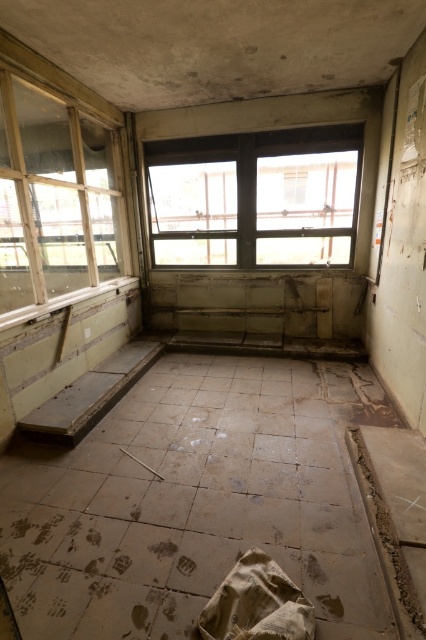
Based on the photo, you are a maintenance worker assessing the building. You need to inspect both the transparent glass window at center and the transparent glass window at left. Which window should you check first if you want to start from the lower one?

You should check the transparent glass window at left first because it is located below the transparent glass window at center, according to the description.

You are an inspector assessing the structural integrity of the windows in the room. You notice two windows, the transparent glass window at center and the transparent glass window at left. Which window has a shorter height?

The transparent glass window at center is not as tall as the transparent glass window at left, so the transparent glass window at center has a shorter height.

You are standing in the middle of the room and looking around. There is a point marked at coordinates (256,196). What object is located at that point?

The transparent glass window at center is located at point (256,196).